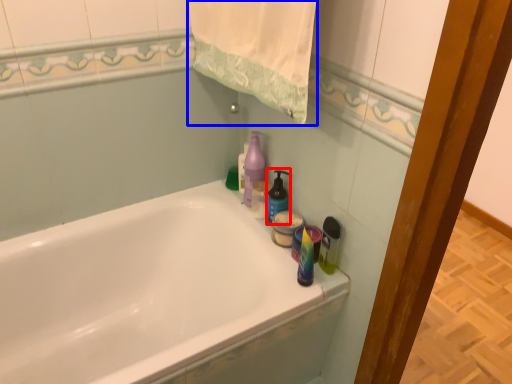
Question: Which point is further to the camera, cleaning product (highlighted by a red box) or bath towel (highlighted by a blue box)?

Choices:
 (A) cleaning product
 (B) bath towel

Answer: (A)